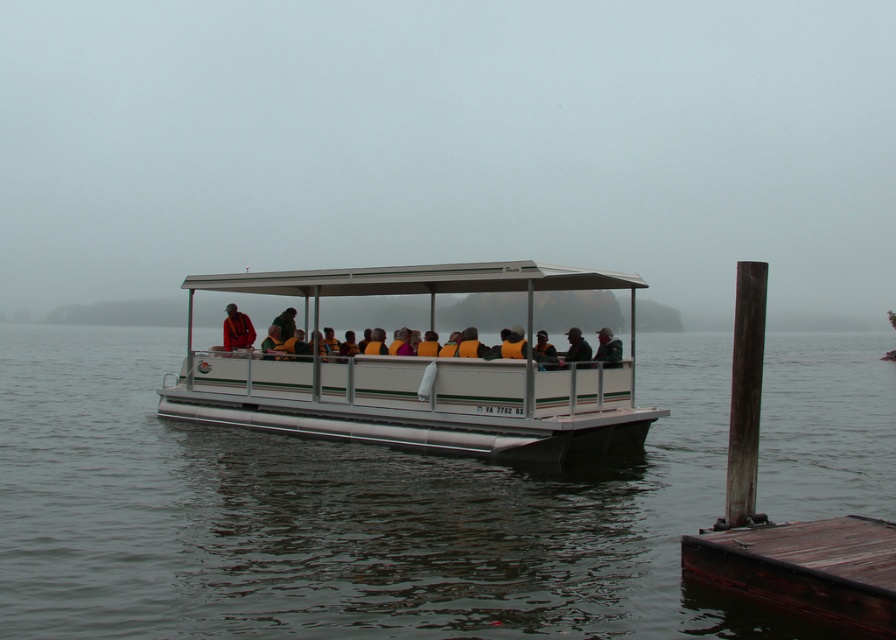
You are standing on the dark brown wooden dock at lower right and want to see the dark green jacket at center. In which direction should you look?

The dark brown wooden dock at lower right is to the right of the dark green jacket at center, so you should look to your left to see the dark green jacket at center.

You are on a pontoon boat and want to know which of the two points, point (798, 570) or point (569, 353), is closer to you. Can you determine this based on the image?

Point (798, 570) is closer to the viewer than point (569, 353).